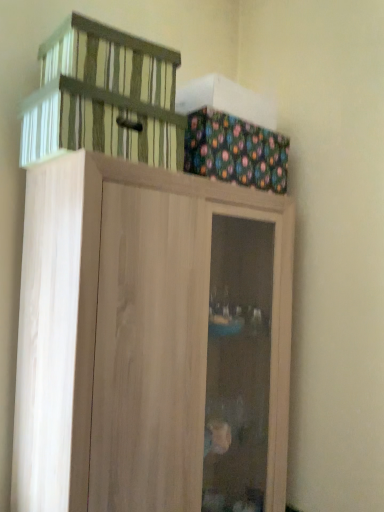
Question: Is striped fabric basket at upper left aimed at light wood cupboard at upper center?

Choices:
 (A) yes
 (B) no

Answer: (B)

Question: Does striped fabric basket at upper left have a greater height compared to light wood cupboard at upper center?

Choices:
 (A) yes
 (B) no

Answer: (B)

Question: Is striped fabric basket at upper left with light wood cupboard at upper center?

Choices:
 (A) no
 (B) yes

Answer: (A)

Question: Is striped fabric basket at upper left closer to camera compared to light wood cupboard at upper center?

Choices:
 (A) yes
 (B) no

Answer: (B)

Question: Does striped fabric basket at upper left appear on the right side of light wood cupboard at upper center?

Choices:
 (A) no
 (B) yes

Answer: (A)

Question: From the image's perspective, is striped fabric basket at upper left above or below light wood cupboard at upper center?

Choices:
 (A) below
 (B) above

Answer: (B)

Question: Do you think striped fabric basket at upper left is within light wood cupboard at upper center, or outside of it?

Choices:
 (A) outside
 (B) inside

Answer: (A)

Question: Considering the positions of striped fabric basket at upper left and light wood cupboard at upper center in the image, is striped fabric basket at upper left wider or thinner than light wood cupboard at upper center?

Choices:
 (A) thin
 (B) wide

Answer: (A)

Question: Would you say striped fabric basket at upper left is to the left or to the right of light wood cupboard at upper center in the picture?

Choices:
 (A) right
 (B) left

Answer: (B)

Question: In the image, is striped fabric basket at upper left on the left side or the right side of multicolored fabric box at upper right?

Choices:
 (A) left
 (B) right

Answer: (A)

Question: Is striped fabric basket at upper left bigger or smaller than multicolored fabric box at upper right?

Choices:
 (A) big
 (B) small

Answer: (B)

Question: From the image's perspective, is striped fabric basket at upper left located above or below multicolored fabric box at upper right?

Choices:
 (A) above
 (B) below

Answer: (A)

Question: Considering the positions of striped fabric basket at upper left and multicolored fabric box at upper right in the image, is striped fabric basket at upper left taller or shorter than multicolored fabric box at upper right?

Choices:
 (A) short
 (B) tall

Answer: (A)

Question: Is multicolored fabric box at upper right taller or shorter than light wood cupboard at upper center?

Choices:
 (A) short
 (B) tall

Answer: (A)

Question: Choose the correct answer: Is multicolored fabric box at upper right inside light wood cupboard at upper center or outside it?

Choices:
 (A) inside
 (B) outside

Answer: (B)